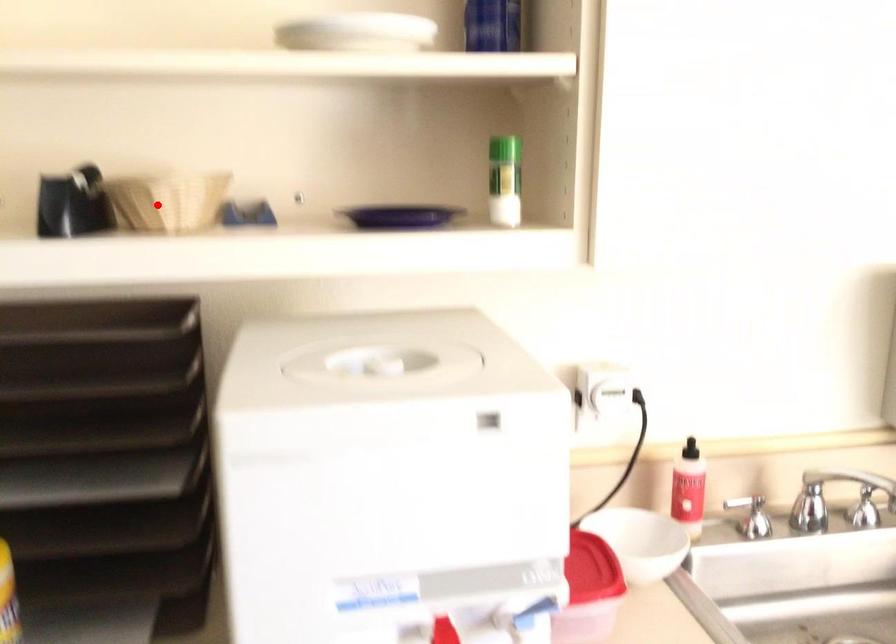
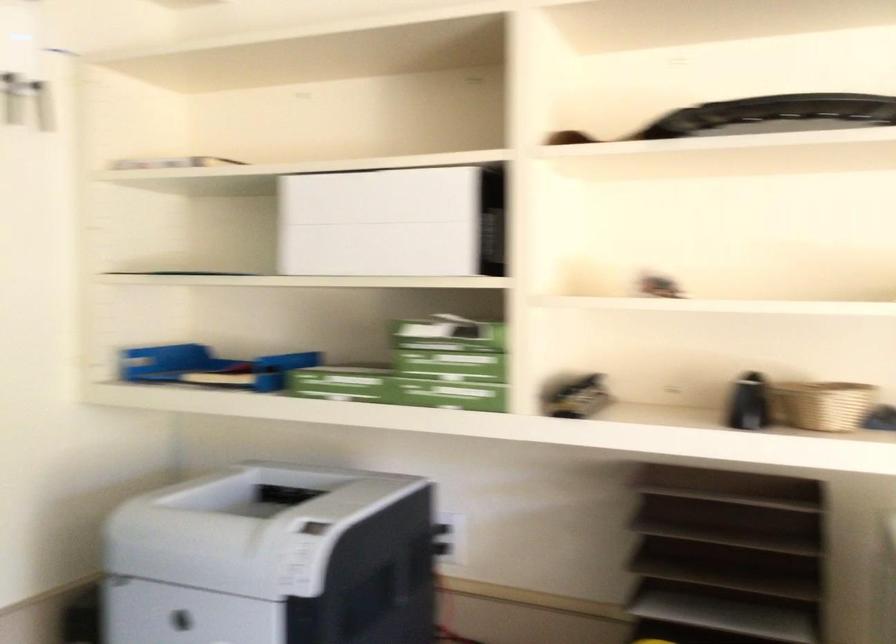
In the second image, find the point that corresponds to the highlighted location in the first image.

(822, 404)